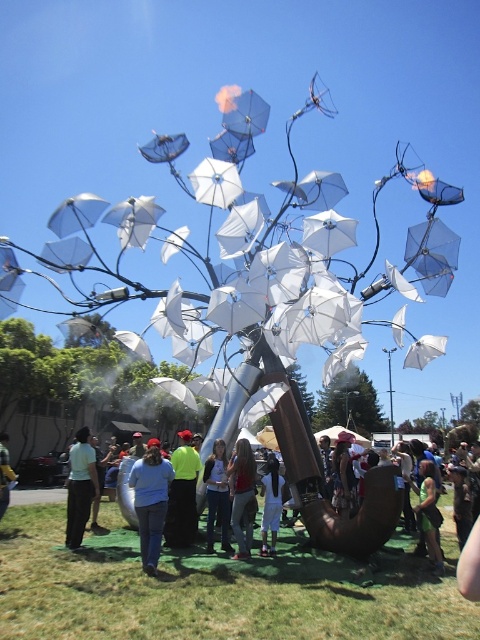
Which is behind, point (244, 440) or point (213, 452)?

The point (213, 452) is behind.

Which is in front, point (240, 524) or point (216, 508)?

Point (240, 524) is in front.

Image resolution: width=480 pixels, height=640 pixels. In order to click on denim jeans at center in this screenshot , I will do `click(242, 496)`.

Identify the location of denim jeans at center. (242, 496).

Describe the element at coordinates (182, 493) in the screenshot. I see `neon yellow shirt at center` at that location.

Measure the distance between neon yellow shirt at center and camera.

9.70 meters

Where is `neon yellow shirt at center`? neon yellow shirt at center is located at coordinates (182, 493).

This screenshot has height=640, width=480. I want to click on wooden hat at center, so click(x=344, y=476).

Is wooden hat at center thinner than light blue jeans at lower left?

Correct, wooden hat at center's width is less than light blue jeans at lower left's.

Between point (343, 497) and point (6, 461), which one is positioned behind?

Point (343, 497)

The image size is (480, 640). What are the coordinates of `wooden hat at center` in the screenshot? It's located at (344, 476).